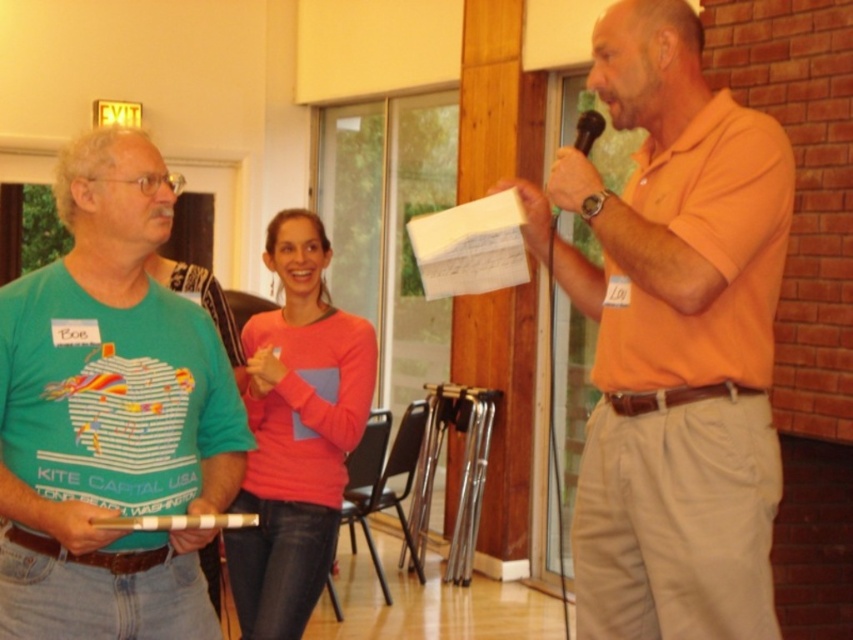
Question: Among these points, which one is farthest from the camera?

Choices:
 (A) (693, 193)
 (B) (254, 628)
 (C) (582, 138)

Answer: (B)

Question: Among these objects, which one is nearest to the camera?

Choices:
 (A) green matte t-shirt at left
 (B) pink matte sweater at center
 (C) black plastic microphone at upper right

Answer: (A)

Question: Can you confirm if orange cotton shirt at center is bigger than pink matte sweater at center?

Choices:
 (A) no
 (B) yes

Answer: (B)

Question: Is pink matte sweater at center to the right of black plastic microphone at upper right from the viewer's perspective?

Choices:
 (A) no
 (B) yes

Answer: (A)

Question: Among these objects, which one is farthest from the camera?

Choices:
 (A) orange cotton shirt at center
 (B) black plastic microphone at upper right
 (C) pink matte sweater at center

Answer: (C)

Question: Can you confirm if orange cotton shirt at center is smaller than black plastic microphone at upper right?

Choices:
 (A) no
 (B) yes

Answer: (A)